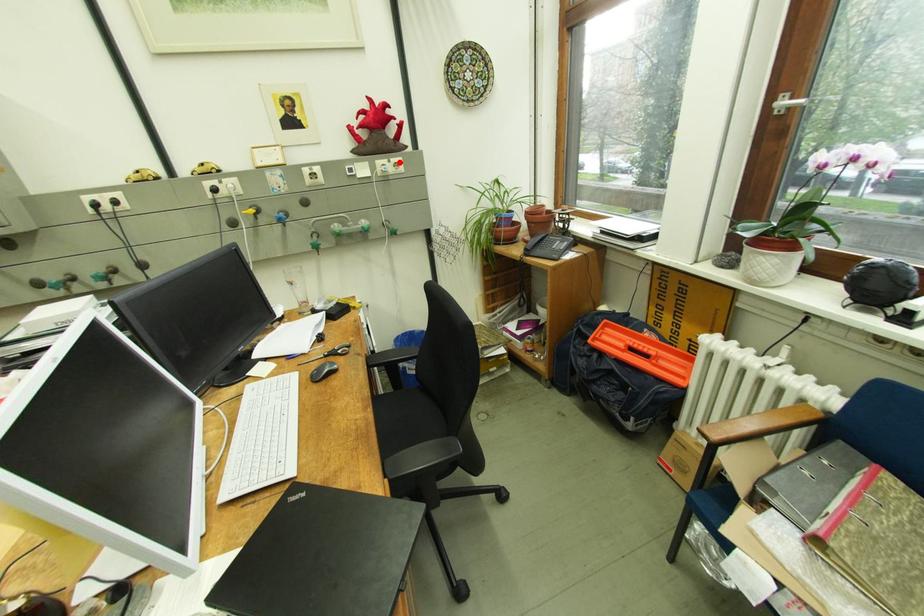
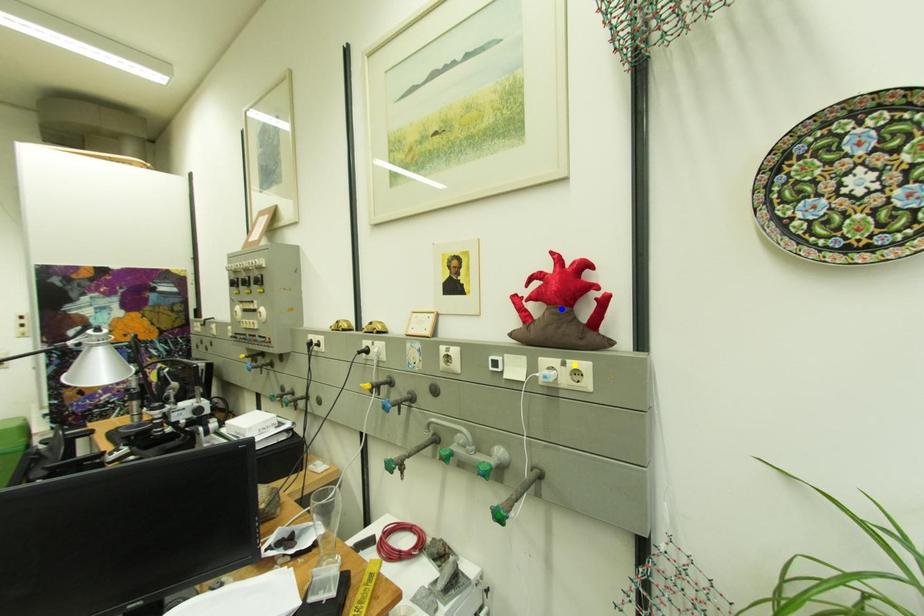
Question: I am providing you with two images of the same scene from different viewpoints. A red point is marked on the first image. You are given multiple points on the second image. Can you choose the point in image 2 that corresponds to the point in image 1?

Choices:
 (A) yellow point
 (B) green point
 (C) blue point

Answer: (A)